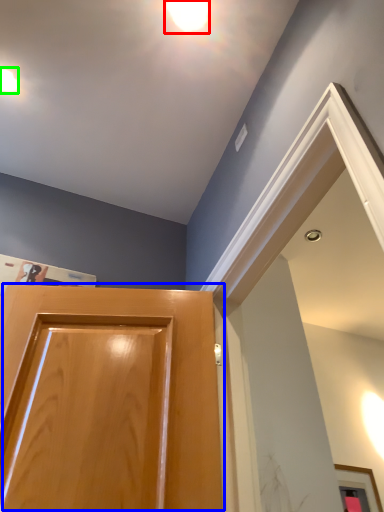
Question: Based on their relative distances, which object is farther from droplight (highlighted by a red box)? Choose from door (highlighted by a blue box) and droplight (highlighted by a green box).

Choices:
 (A) door
 (B) droplight

Answer: (A)